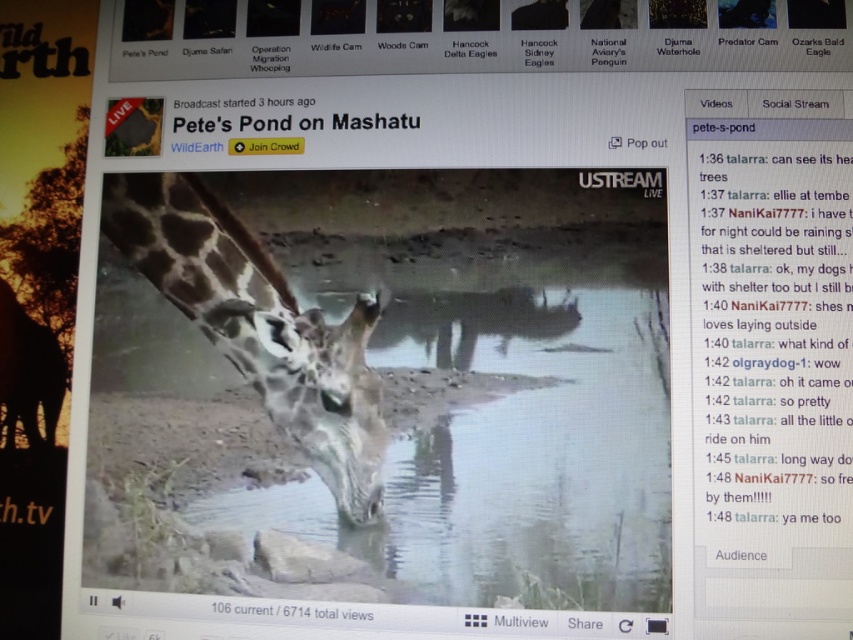
You are a wildlife researcher analyzing the live stream from Pete s Pond on Mashatu. You need to determine if the point at coordinates (532,454) on the screen is over the clear water at center. Based on the provided information, what is your conclusion?

The point at coordinates (532,454) is on clear water at center, so the conclusion is yes.

You are a wildlife photographer aiming to capture the giraffe and its reflection in the water. Based on the scene, can you determine if the reflection of the spotted fur giraffe at center will be fully visible in the clear water at center?

The clear water at center has a lesser height compared to spotted fur giraffe at center, so the reflection of the spotted fur giraffe at center may not be fully visible in the clear water at center due to the water being shallower than the giraffe.

You are a wildlife researcher observing the giraffe at point (635, 300). You need to place a motion sensor 1.2 meters away from the giraffe. Can you place it at the current position of the giraffe?

The point (635, 300) is 1.23 meters away from the giraffe, so placing the motion sensor at the current position of the giraffe would be too close since it requires 1.2 meters distance.